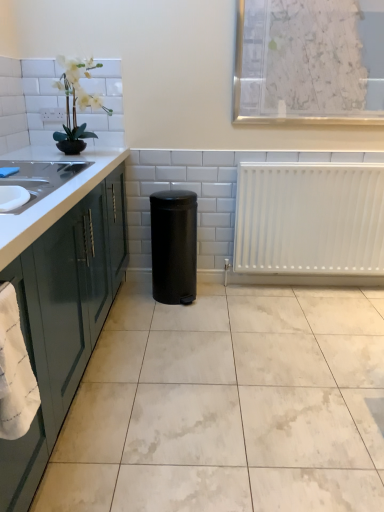
Locate an element on the screen. unoccupied area in front of black matte trash can at center is located at coordinates (180, 318).